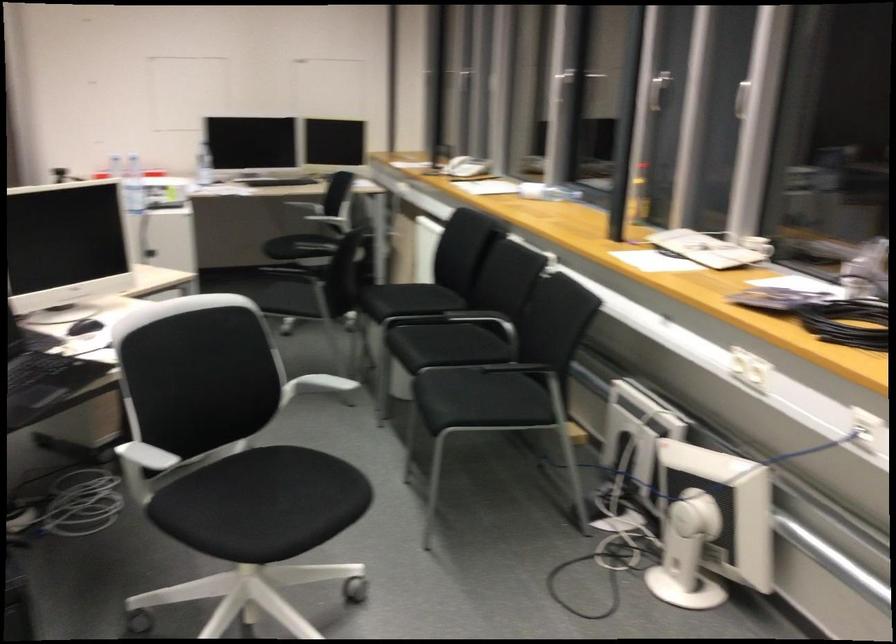
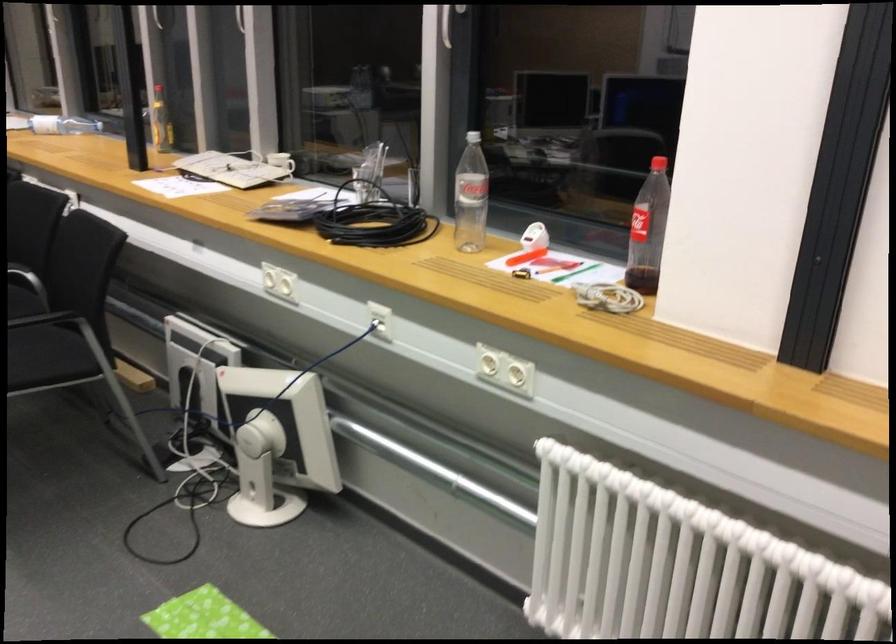
Where in the second image is the point corresponding to the point at 501,395 from the first image?

(47, 357)